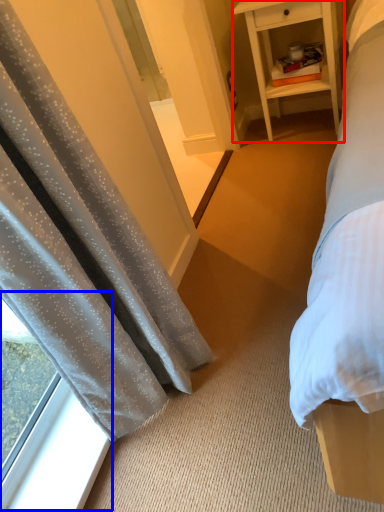
Question: Among these objects, which one is farthest to the camera, nightstand (highlighted by a red box) or window (highlighted by a blue box)?

Choices:
 (A) nightstand
 (B) window

Answer: (A)